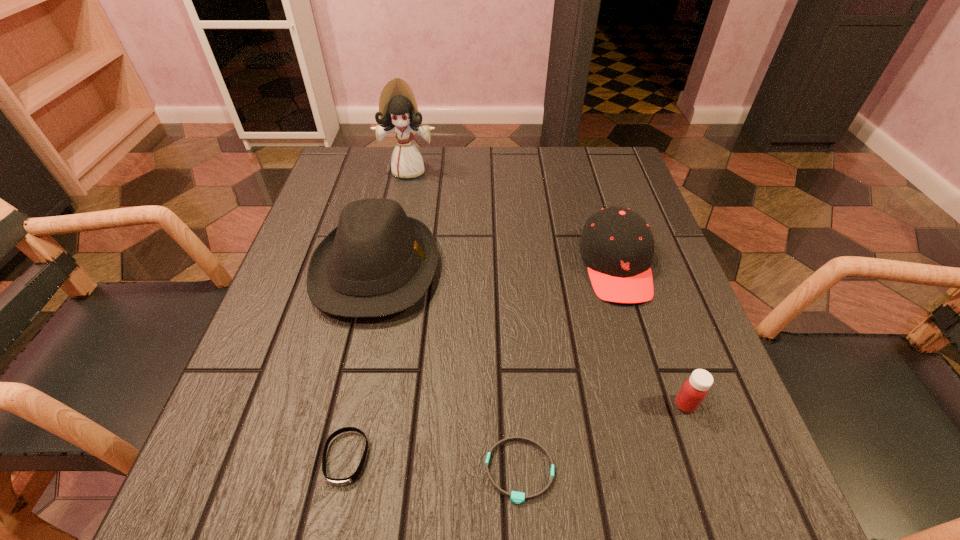
Identify the location of the tallest object. The height and width of the screenshot is (540, 960). (398, 111).

Identify the location of the farthest object. (398, 111).

Where is `fedora`? This screenshot has height=540, width=960. fedora is located at coordinates (378, 261).

The height and width of the screenshot is (540, 960). What are the coordinates of `the fourth shortest object` in the screenshot? It's located at (617, 245).

Where is `the fourth tallest object`? Image resolution: width=960 pixels, height=540 pixels. the fourth tallest object is located at coordinates (694, 390).

Where is `the third nearest object`? The height and width of the screenshot is (540, 960). the third nearest object is located at coordinates (694, 390).

Where is `the taller wristband`? The height and width of the screenshot is (540, 960). the taller wristband is located at coordinates (344, 481).

Locate an element on the screen. the fifth tallest object is located at coordinates (344, 481).

I want to click on the shorter wristband, so click(x=516, y=497).

The height and width of the screenshot is (540, 960). I want to click on the shortest object, so click(x=516, y=497).